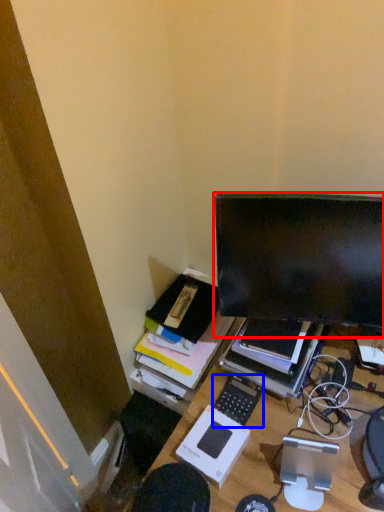
Question: Among these objects, which one is farthest to the camera, computer monitor (highlighted by a red box) or computer keyboard (highlighted by a blue box)?

Choices:
 (A) computer monitor
 (B) computer keyboard

Answer: (B)